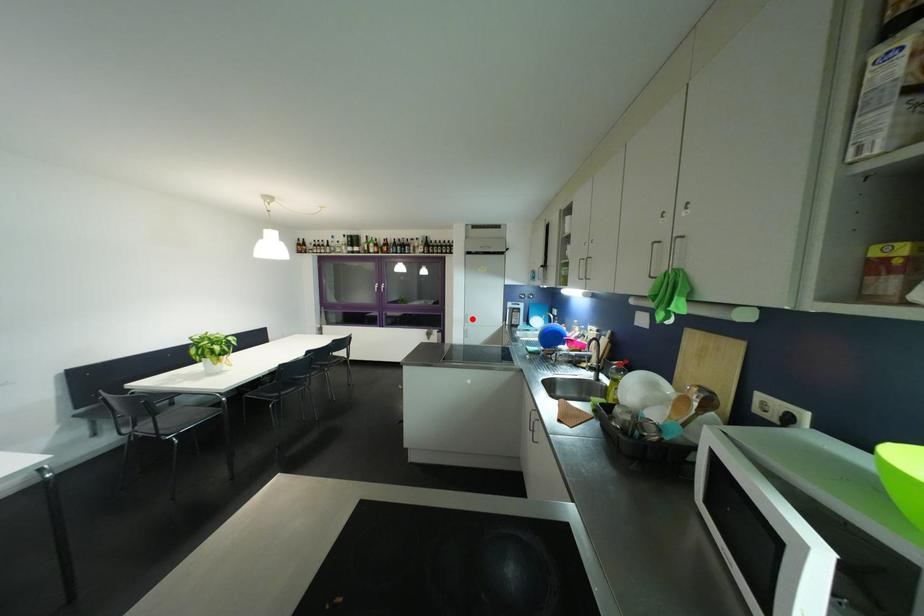
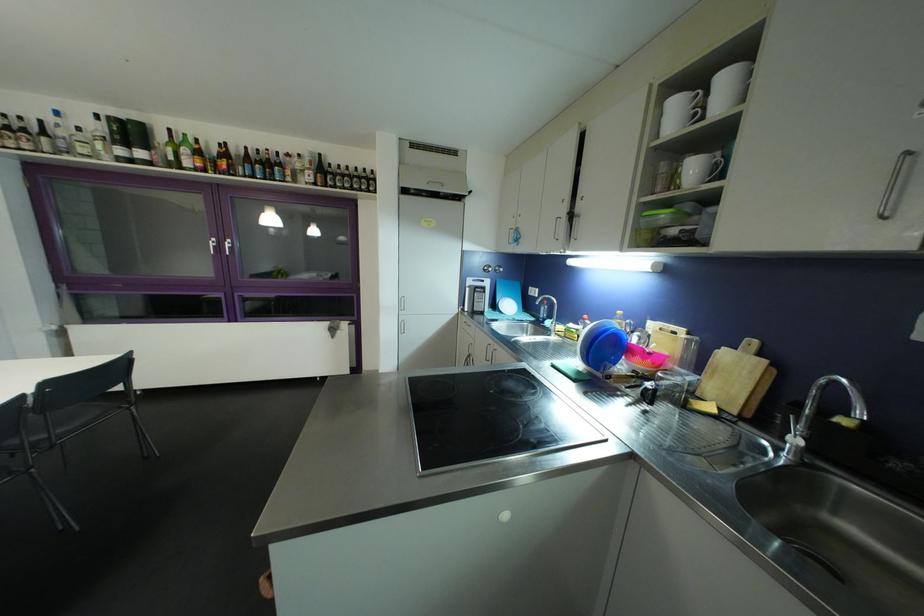
Question: I am providing you with two images of the same scene from different viewpoints. In image1, a red point is highlighted. Considering the same 3D point in image2, which of the following is correct?

Choices:
 (A) It is closer
 (B) It is farther

Answer: (B)